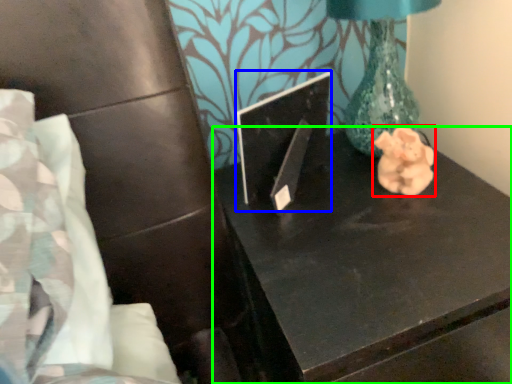
Question: Considering the real-world distances, which object is farthest from animal (highlighted by a red box)? laptop (highlighted by a blue box) or table (highlighted by a green box)?

Choices:
 (A) laptop
 (B) table

Answer: (A)